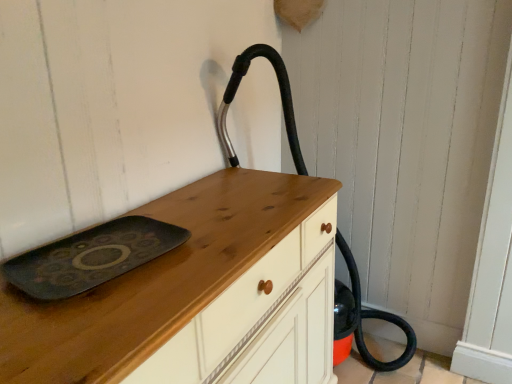
Find the location of a particular element. The height and width of the screenshot is (384, 512). wooden chest of drawers at center is located at coordinates (156, 280).

Describe the element at coordinates (364, 317) in the screenshot. The height and width of the screenshot is (384, 512). I see `black rubber hose at center` at that location.

The height and width of the screenshot is (384, 512). In order to click on matte black tray at center in this screenshot , I will do `click(91, 257)`.

Considering the sizes of wooden chest of drawers at center and black rubber hose at center in the image, is wooden chest of drawers at center wider or thinner than black rubber hose at center?

wooden chest of drawers at center is thinner than black rubber hose at center.

Considering the positions of points (191, 259) and (238, 76), is point (191, 259) farther from camera compared to point (238, 76)?

No, (191, 259) is in front of (238, 76).

The width and height of the screenshot is (512, 384). In order to click on chest of drawers in front of the black rubber hose at center in this screenshot , I will do `click(156, 280)`.

Which is more to the right, wooden chest of drawers at center or black rubber hose at center?

From the viewer's perspective, black rubber hose at center appears more on the right side.

Considering the sizes of objects matte black tray at center and wooden chest of drawers at center in the image provided, who is thinner, matte black tray at center or wooden chest of drawers at center?

matte black tray at center.

In the image, is matte black tray at center positioned in front of or behind wooden chest of drawers at center?

Visually, matte black tray at center is located behind wooden chest of drawers at center.

From a real-world perspective, is matte black tray at center physically located above or below wooden chest of drawers at center?

matte black tray at center is situated higher than wooden chest of drawers at center in the real world.

There is a wooden chest of drawers at center. Identify the location of tray above it (from a real-world perspective). The image size is (512, 384). (91, 257).

Is wooden chest of drawers at center positioned far away from matte black tray at center?

That's not correct — wooden chest of drawers at center is a little close to matte black tray at center.

Is wooden chest of drawers at center facing towards matte black tray at center?

No, wooden chest of drawers at center is not oriented towards matte black tray at center.

Considering their positions, is wooden chest of drawers at center located in front of or behind matte black tray at center?

In the image, wooden chest of drawers at center appears in front of matte black tray at center.

Based on their sizes in the image, would you say matte black tray at center is bigger or smaller than black rubber hose at center?

In the image, matte black tray at center appears to be smaller than black rubber hose at center.

Does matte black tray at center contain black rubber hose at center?

No, black rubber hose at center is not a part of matte black tray at center.

Does matte black tray at center touch black rubber hose at center?

They are not placed beside each other.

Looking at this image, from a real-world perspective, is matte black tray at center positioned above or below black rubber hose at center?

matte black tray at center is above black rubber hose at center.

Between black rubber hose at center and wooden chest of drawers at center, which one has smaller size?

wooden chest of drawers at center is smaller.

Between black rubber hose at center and wooden chest of drawers at center, which one has larger width?

With larger width is black rubber hose at center.

Is black rubber hose at center aimed at wooden chest of drawers at center?

No.

In the image, there is a black rubber hose at center. Where is `the chest of drawers below it (from the image's perspective)`? This screenshot has height=384, width=512. the chest of drawers below it (from the image's perspective) is located at coordinates point(156,280).

Is black rubber hose at center far from matte black tray at center?

Absolutely, black rubber hose at center is distant from matte black tray at center.

Measure the distance between black rubber hose at center and matte black tray at center.

The distance of black rubber hose at center from matte black tray at center is 1.17 meters.

Considering the relative sizes of black rubber hose at center and matte black tray at center in the image provided, is black rubber hose at center taller than matte black tray at center?

Indeed, black rubber hose at center has a greater height compared to matte black tray at center.

From the image's perspective, who appears lower, black rubber hose at center or matte black tray at center?

matte black tray at center, from the image's perspective.

Where is `the chest of drawers that appears below the black rubber hose at center (from a real-world perspective)`? The width and height of the screenshot is (512, 384). the chest of drawers that appears below the black rubber hose at center (from a real-world perspective) is located at coordinates (156, 280).

Find the location of `the chest of drawers located in front of the matte black tray at center`. the chest of drawers located in front of the matte black tray at center is located at coordinates tap(156, 280).

In the scene shown: Looking at the image, which one is located closer to wooden chest of drawers at center, matte black tray at center or black rubber hose at center?

Based on the image, matte black tray at center appears to be nearer to wooden chest of drawers at center.

Based on their spatial positions, is matte black tray at center or wooden chest of drawers at center closer to black rubber hose at center?

Among the two, wooden chest of drawers at center is located nearer to black rubber hose at center.

When comparing their distances from matte black tray at center, does black rubber hose at center or wooden chest of drawers at center seem further?

Based on the image, black rubber hose at center appears to be further to matte black tray at center.

From the image, which object appears to be farther from wooden chest of drawers at center, black rubber hose at center or matte black tray at center?

Among the two, black rubber hose at center is located further to wooden chest of drawers at center.

When comparing their distances from black rubber hose at center, does wooden chest of drawers at center or matte black tray at center seem closer?

wooden chest of drawers at center lies closer to black rubber hose at center than the other object.

Which object lies further to the anchor point matte black tray at center, wooden chest of drawers at center or black rubber hose at center?

Based on the image, black rubber hose at center appears to be further to matte black tray at center.

Find the location of a particular element. chest of drawers between matte black tray at center and black rubber hose at center from left to right is located at coordinates (156, 280).